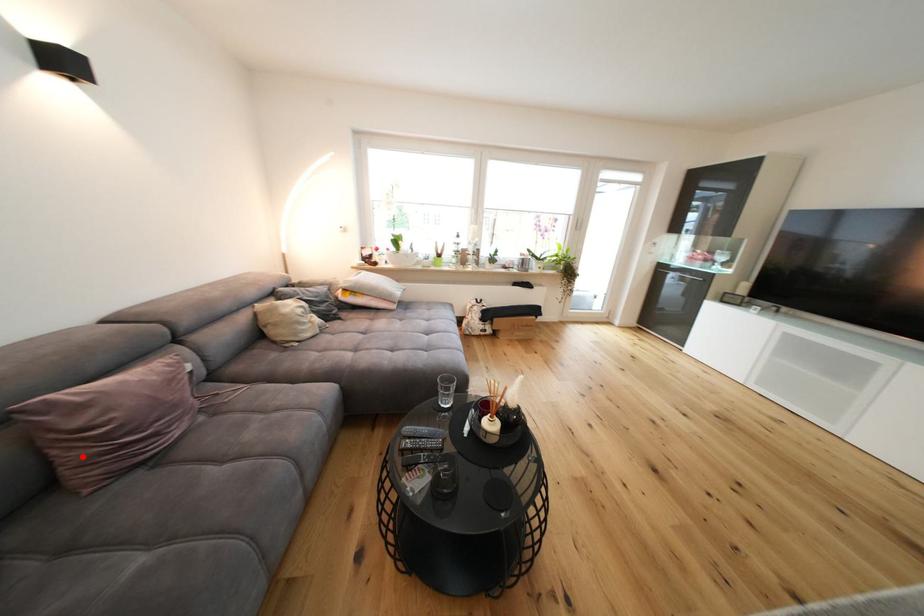
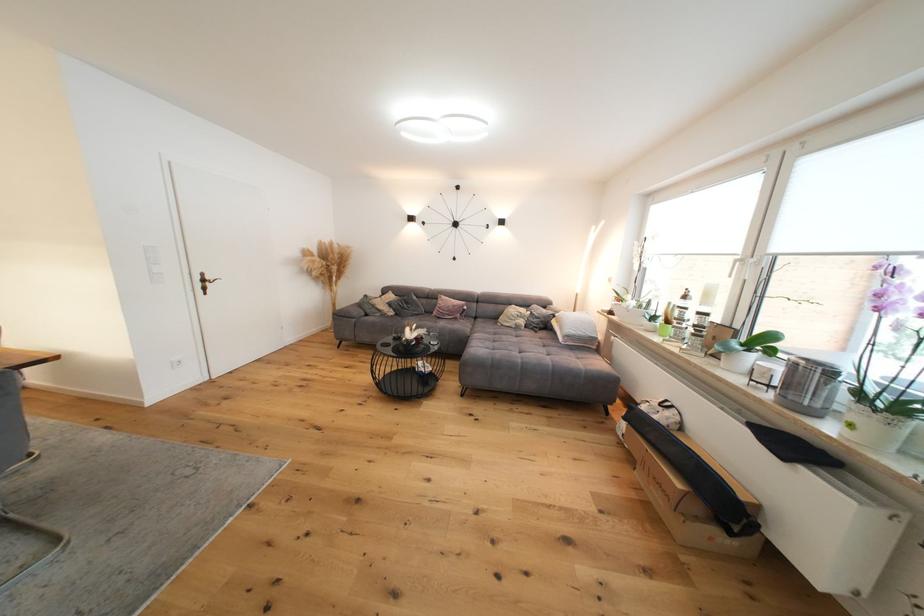
Locate, in the second image, the point that corresponds to the highlighted location in the first image.

(444, 310)